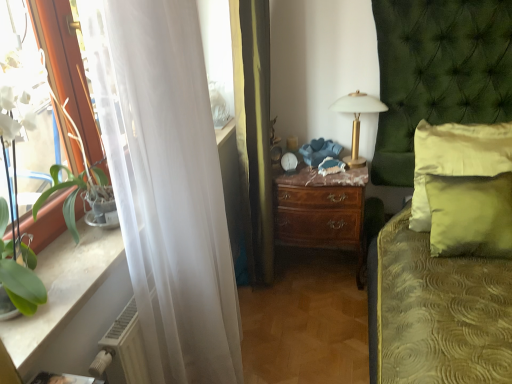
Question: Does green satin pillow at right, acting as the second pillow starting from the front, have a greater height compared to brown wood nightstand at center?

Choices:
 (A) yes
 (B) no

Answer: (A)

Question: Is green satin pillow at right, the first pillow positioned from the back, turned away from brown wood nightstand at center?

Choices:
 (A) yes
 (B) no

Answer: (B)

Question: Is green satin pillow at right, the first pillow positioned from the back, next to brown wood nightstand at center and touching it?

Choices:
 (A) no
 (B) yes

Answer: (A)

Question: From the image's perspective, is green satin pillow at right, the first pillow positioned from the back, on brown wood nightstand at center?

Choices:
 (A) no
 (B) yes

Answer: (B)

Question: Is green satin pillow at right, acting as the second pillow starting from the front, smaller than brown wood nightstand at center?

Choices:
 (A) no
 (B) yes

Answer: (B)

Question: Which is correct: green satin pillow at right, acting as the second pillow starting from the front, is inside white sheer curtain at left, or outside of it?

Choices:
 (A) outside
 (B) inside

Answer: (A)

Question: Considering the positions of point (424, 155) and point (190, 115), is point (424, 155) closer or farther from the camera than point (190, 115)?

Choices:
 (A) farther
 (B) closer

Answer: (A)

Question: In terms of width, does green satin pillow at right, acting as the second pillow starting from the front, look wider or thinner when compared to white sheer curtain at left?

Choices:
 (A) thin
 (B) wide

Answer: (A)

Question: From their relative heights in the image, would you say green satin pillow at right, acting as the second pillow starting from the front, is taller or shorter than white sheer curtain at left?

Choices:
 (A) short
 (B) tall

Answer: (A)

Question: From the image's perspective, is white plastic radiator at lower left positioned above or below white sheer curtain at left?

Choices:
 (A) below
 (B) above

Answer: (A)

Question: Is white plastic radiator at lower left taller or shorter than white sheer curtain at left?

Choices:
 (A) short
 (B) tall

Answer: (A)

Question: Is white plastic radiator at lower left inside the boundaries of white sheer curtain at left, or outside?

Choices:
 (A) outside
 (B) inside

Answer: (B)

Question: Is point (123, 367) closer or farther from the camera than point (195, 127)?

Choices:
 (A) farther
 (B) closer

Answer: (A)

Question: In the image, is green satin pillow at right, the first pillow positioned from the back, positioned in front of or behind green textured bed at center?

Choices:
 (A) front
 (B) behind

Answer: (B)

Question: From a real-world perspective, is green satin pillow at right, acting as the second pillow starting from the front, above or below green textured bed at center?

Choices:
 (A) below
 (B) above

Answer: (A)